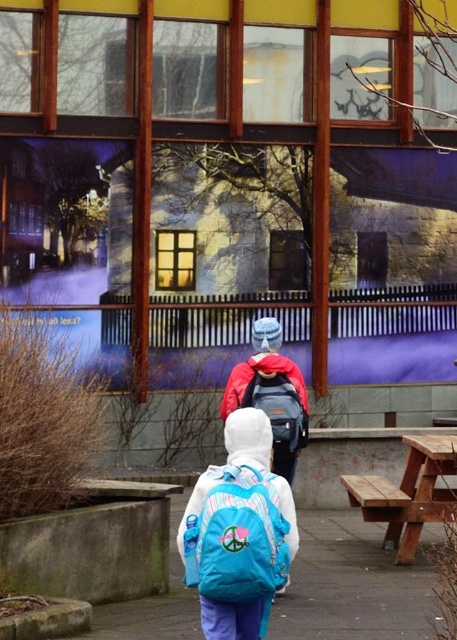
Can you confirm if blue fabric backpack at center is thinner than brown wooden picnic table at lower right?

Yes.

Between point (191, 534) and point (441, 476), which one is positioned in front?

Point (191, 534)

Does point (229, 550) lie in front of point (425, 444)?

Yes, point (229, 550) is in front of point (425, 444).

Where is `blue fabric backpack at center`? The width and height of the screenshot is (457, 640). blue fabric backpack at center is located at coordinates (237, 536).

Based on the photo, does blue fabric backpack at lower center appear under blue fabric backpack at center?

Indeed, blue fabric backpack at lower center is positioned under blue fabric backpack at center.

Does blue fabric backpack at lower center appear on the left side of blue fabric backpack at center?

Incorrect, blue fabric backpack at lower center is not on the left side of blue fabric backpack at center.

Between point (338, 572) and point (189, 540), which one is positioned behind?

The point (338, 572) is behind.

At what (x,y) coordinates should I click in order to perform the action: click on blue fabric backpack at lower center. Please return your answer as a coordinate pair (x, y). The image size is (457, 640). Looking at the image, I should click on (354, 582).

Which is behind, point (402, 554) or point (298, 449)?

The point (402, 554) is behind.

Image resolution: width=457 pixels, height=640 pixels. Describe the element at coordinates (409, 493) in the screenshot. I see `brown wooden picnic table at lower right` at that location.

Identify the location of brown wooden picnic table at lower right. The height and width of the screenshot is (640, 457). (409, 493).